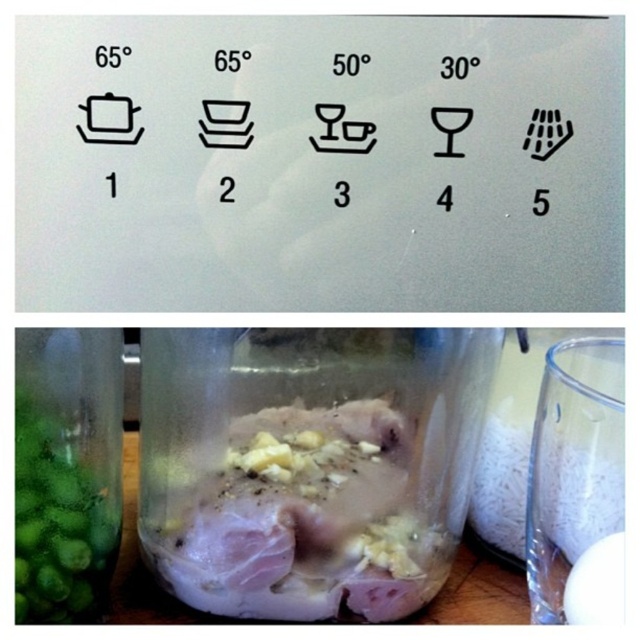
Question: Which point is farther to the camera?

Choices:
 (A) translucent plastic chicken at center
 (B) transparent glass jar at right
 (C) green matte glass jar at lower left

Answer: (A)

Question: Does translucent plastic chicken at center lie in front of green matte glass jar at lower left?

Choices:
 (A) yes
 (B) no

Answer: (B)

Question: Is translucent plastic chicken at center wider than transparent glass jar at right?

Choices:
 (A) no
 (B) yes

Answer: (B)

Question: Based on their relative distances, which object is nearer to the translucent plastic chicken at center?

Choices:
 (A) transparent glass jar at right
 (B) green matte glass jar at lower left

Answer: (B)

Question: Which point is farther to the camera?

Choices:
 (A) (118, 332)
 (B) (196, 344)

Answer: (A)

Question: Does translucent plastic chicken at center come behind green matte glass jar at lower left?

Choices:
 (A) no
 (B) yes

Answer: (B)